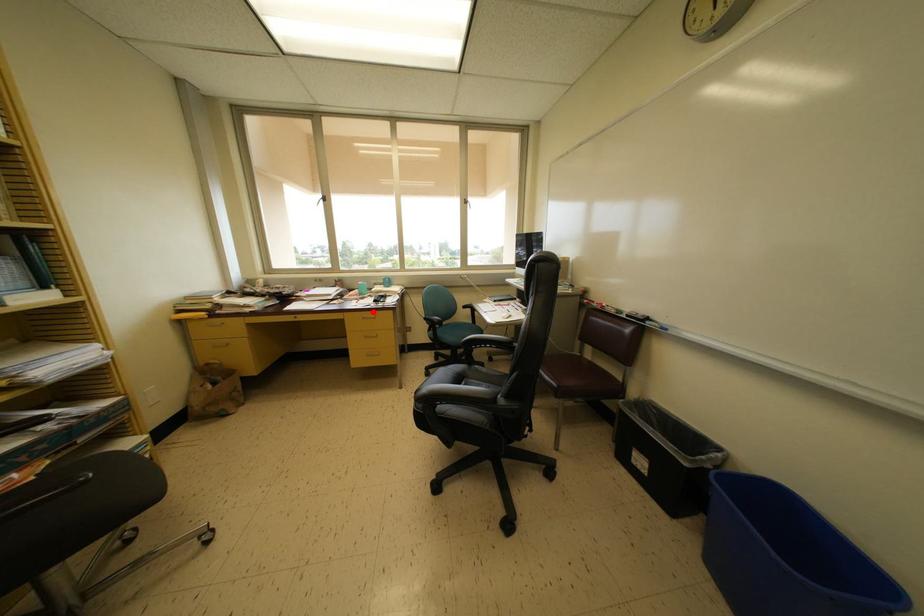
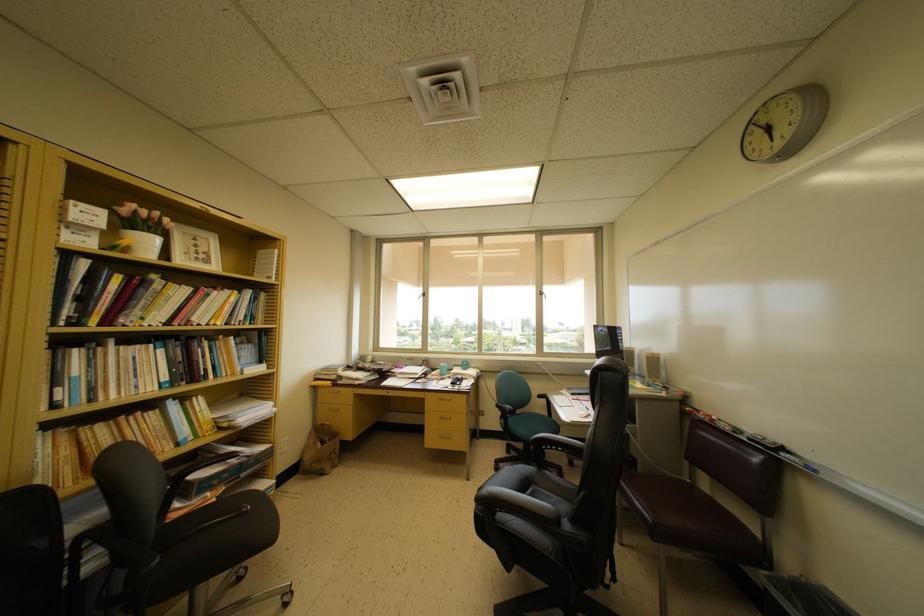
Locate, in the second image, the point that corresponds to the highlighted location in the first image.

(451, 394)